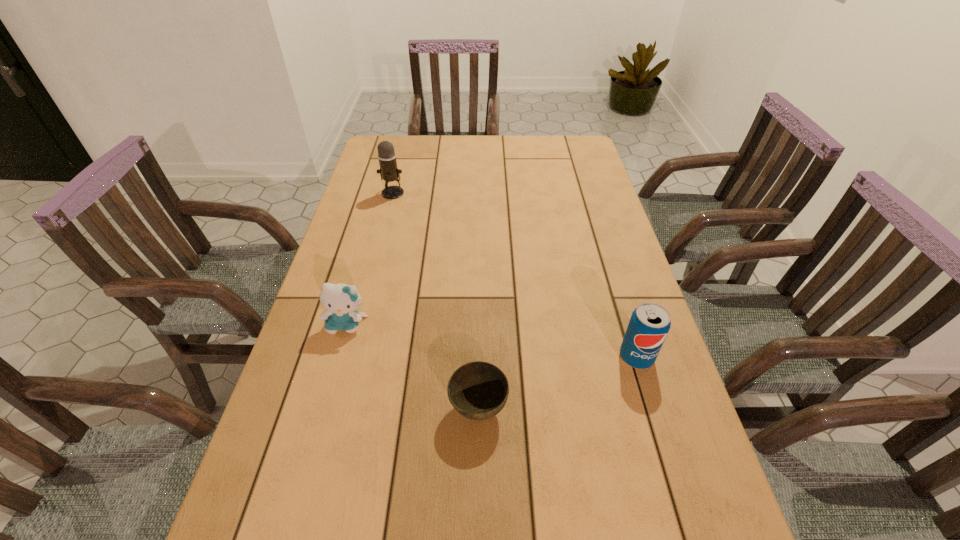
This screenshot has width=960, height=540. In order to click on unoccupied position between the microphone and the bowl in this screenshot , I will do 436,301.

Identify the location of free space between the rightmost object and the tallest object. (515, 275).

Locate an element on the screen. The image size is (960, 540). free space between the second object from right to left and the kitten is located at coordinates (413, 366).

Find the location of a particular element. The image size is (960, 540). vacant space that's between the third object from left to right and the second farthest object is located at coordinates click(x=413, y=366).

This screenshot has width=960, height=540. In order to click on free spot between the third nearest object and the bowl in this screenshot , I will do `click(413, 366)`.

Locate an element on the screen. free point between the bowl and the kitten is located at coordinates (413, 366).

Locate an element on the screen. The height and width of the screenshot is (540, 960). free space between the farthest object and the soda can is located at coordinates (515, 275).

This screenshot has width=960, height=540. I want to click on object identified as the closest to the microphone, so click(x=342, y=301).

You are a GUI agent. You are given a task and a screenshot of the screen. Output one action in this format:
    pyautogui.click(x=<x>, y=<y>)
    Task: Click on the second closest object to the second farthest object
    
    Given the screenshot: What is the action you would take?
    pyautogui.click(x=389, y=172)

Find the location of a particular element. The height and width of the screenshot is (540, 960). vacant area that satisfies the following two spatial constraints: 1. on the face of the soda can; 2. on the left side of the kitten is located at coordinates (337, 357).